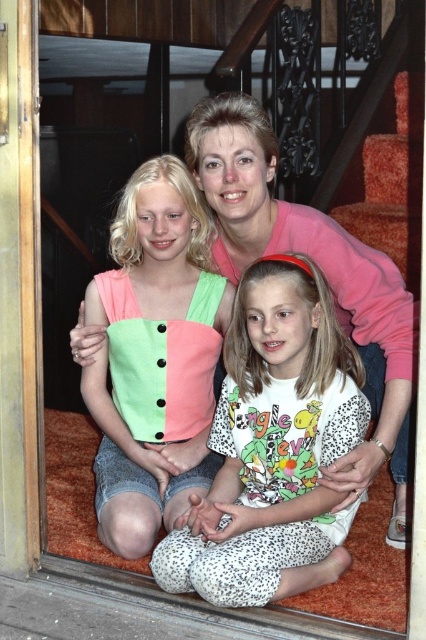
You are a photographer taking a picture of the family scene. You notice the white leopard print pajama pants at center and the matte cotton tank top at center. Which clothing item appears larger in the photo?

The white leopard print pajama pants at center appears larger in the photo because it is closer to the viewer than the matte cotton tank top at center.

You are a fashion designer observing the clothing items worn by the central figure in the image. Which of the two items, the white leopard print pajama pants at center or the matte cotton tank top at center, has a greater horizontal span when viewed from the front?

The white leopard print pajama pants at center has a greater horizontal span than the matte cotton tank top at center, as its width surpasses that of the tank top.

You are a fashion designer observing the clothing items in the scene. You need to determine if the white leopard print pajama pants at center and the matte cotton tank top at center can be paired together in a coordinated outfit. Considering their proximity in the image, would their placement suggest they are part of the same ensemble?

The white leopard print pajama pants at center is 11.41 inches away from matte cotton tank top at center. Since the distance between them is relatively close, it suggests they could be part of the same coordinated outfit.